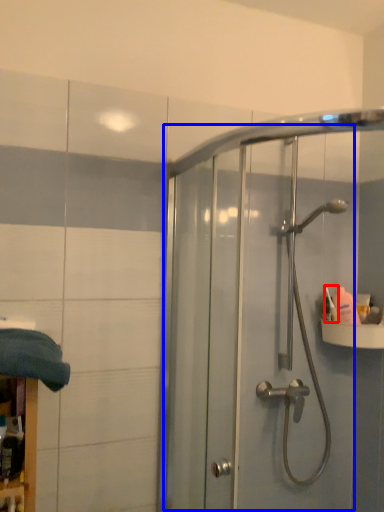
Question: Which object appears farthest to the camera in this image, toiletry (highlighted by a red box) or screen door (highlighted by a blue box)?

Choices:
 (A) toiletry
 (B) screen door

Answer: (A)